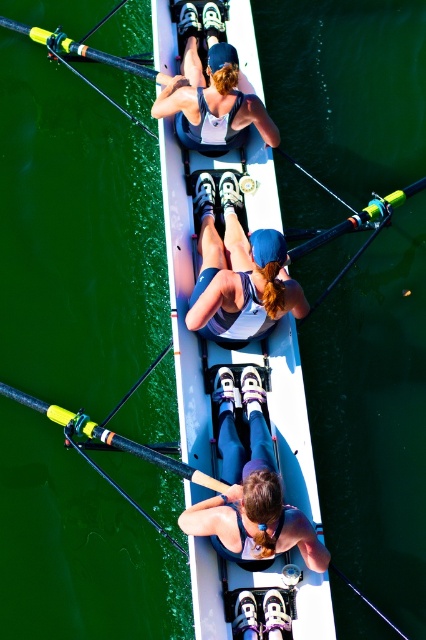
Can you confirm if matte purple leggings at center is taller than black rubber oar at center?

Yes, matte purple leggings at center is taller than black rubber oar at center.

The image size is (426, 640). Describe the element at coordinates (250, 490) in the screenshot. I see `matte purple leggings at center` at that location.

Is point (250, 445) closer to viewer compared to point (71, 422)?

Yes, point (250, 445) is closer to viewer.

Find the location of a particular element. Image resolution: width=426 pixels, height=640 pixels. matte purple leggings at center is located at coordinates (250, 490).

Is matte blue tank top at center positioned behind matte blue tank top at upper center?

That is False.

Who is more forward, (204,259) or (199,93)?

Point (204,259)

Image resolution: width=426 pixels, height=640 pixels. In order to click on matte blue tank top at center in this screenshot , I will do `click(238, 272)`.

Looking at this image, can you confirm if matte purple leggings at center is positioned above matte blue tank top at center?

No, matte purple leggings at center is not above matte blue tank top at center.

Is point (256, 438) positioned after point (230, 232)?

No.

Locate an element on the screen. Image resolution: width=426 pixels, height=640 pixels. matte purple leggings at center is located at coordinates (250, 490).